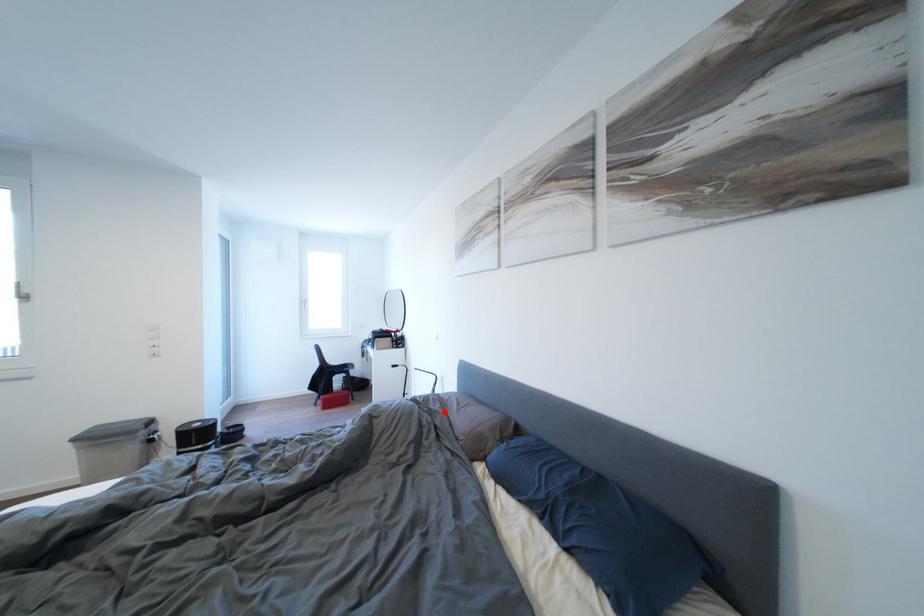
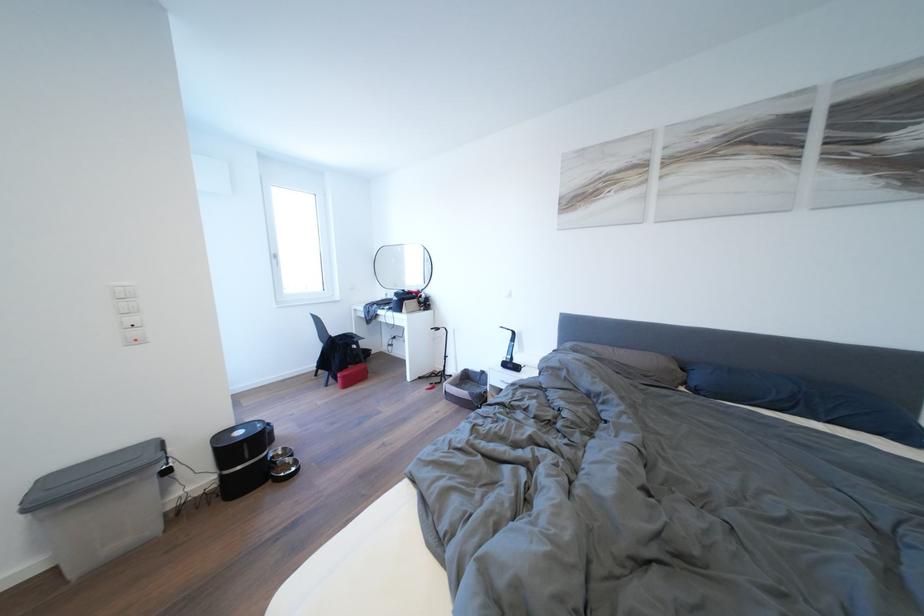
Question: I am providing you with two images of the same scene from different viewpoints. A red point is marked on the first image. At the location where the point appears in image 1, is it still visible in image 2?

Choices:
 (A) Yes
 (B) No

Answer: (A)